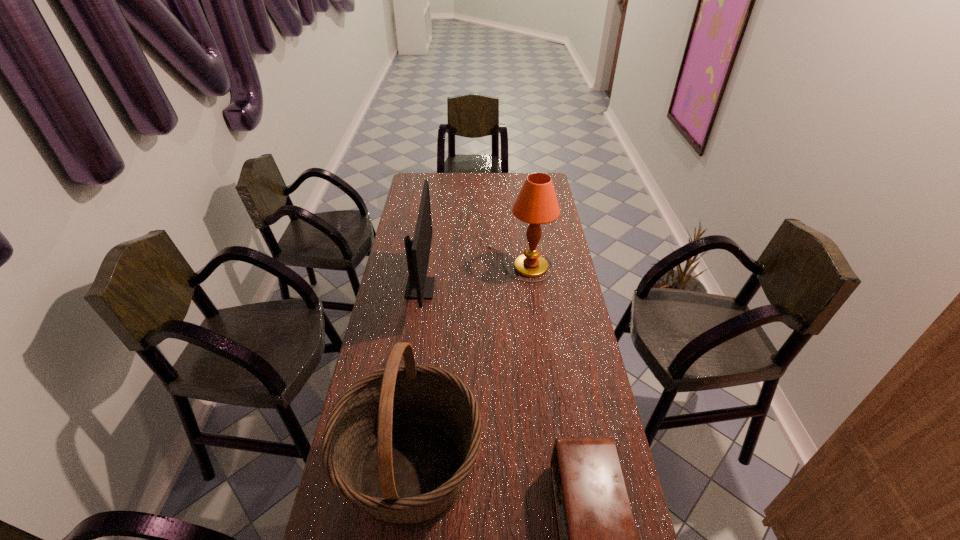
Identify the location of lamp. (536, 204).

Identify the location of computer monitor. The image size is (960, 540). pyautogui.click(x=420, y=287).

You are a GUI agent. You are given a task and a screenshot of the screen. Output one action in this format:
    pyautogui.click(x=<x>, y=<y>)
    Task: Click on the vacant position located 0.120m on the front of the lamp
    This screenshot has height=540, width=960.
    Given the screenshot: What is the action you would take?
    pyautogui.click(x=524, y=304)

Where is `free region located on the front-facing side of the computer monitor`? The width and height of the screenshot is (960, 540). free region located on the front-facing side of the computer monitor is located at coordinates (510, 289).

You are a GUI agent. You are given a task and a screenshot of the screen. Output one action in this format:
    pyautogui.click(x=<x>, y=<y>)
    Task: Click on the object located at the left edge
    The height and width of the screenshot is (540, 960).
    Given the screenshot: What is the action you would take?
    pyautogui.click(x=420, y=287)

The image size is (960, 540). In order to click on object at the right edge in this screenshot , I will do `click(536, 204)`.

Find the location of a particular element. The height and width of the screenshot is (540, 960). free region at the far edge of the desktop is located at coordinates (494, 186).

The width and height of the screenshot is (960, 540). What are the coordinates of `vacant space at the left edge` in the screenshot? It's located at (372, 334).

In the image, there is a desktop. Where is `vacant space at the right edge`? Image resolution: width=960 pixels, height=540 pixels. vacant space at the right edge is located at coordinates (584, 404).

Image resolution: width=960 pixels, height=540 pixels. In the image, there is a desktop. Find the location of `vacant area at the far left corner`. vacant area at the far left corner is located at coordinates (419, 177).